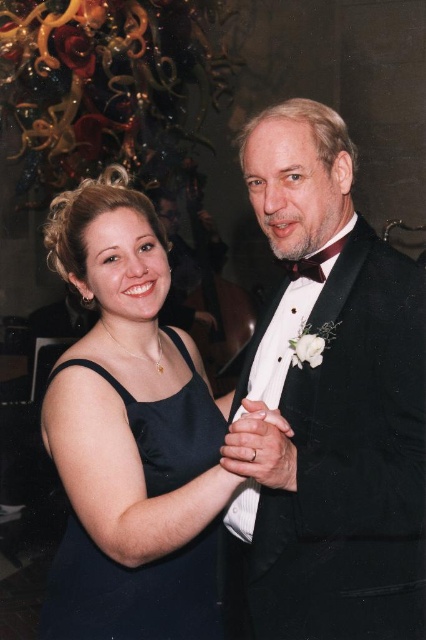
You are a photographer at a formal event. You need to capture a photo where the satin black dress at center and bow tie at center are both clearly visible. Based on their positions, which one is located to the left of the other?

The satin black dress at center is positioned on the left side of bow tie at center, so the satin black dress at center is to the left of the bow tie at center.

You are taking a photo of the scene and want to focus on both point (317, 211) and point (95, 548). Which point is closer to the camera?

Point (95, 548) is closer to the camera than point (317, 211).